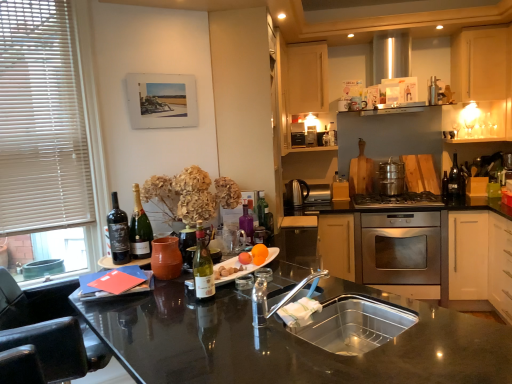
Question: Is light wood cabinet at upper center, the 2th cabinetry from the right, to the left of matte glass wine at left, which is counted as the second wine, starting from the right, from the viewer's perspective?

Choices:
 (A) no
 (B) yes

Answer: (A)

Question: Would you consider light wood cabinet at upper center, which is the first cabinetry from left to right, to be distant from matte glass wine at left, positioned as the first wine in left-to-right order?

Choices:
 (A) no
 (B) yes

Answer: (B)

Question: Considering the relative sizes of light wood cabinet at upper center, which is the first cabinetry from left to right, and matte glass wine at left, positioned as the first wine in left-to-right order, in the image provided, is light wood cabinet at upper center, which is the first cabinetry from left to right, thinner than matte glass wine at left, positioned as the first wine in left-to-right order,?

Choices:
 (A) yes
 (B) no

Answer: (B)

Question: Does light wood cabinet at upper center, which is the first cabinetry from left to right, come in front of matte glass wine at left, which is counted as the second wine, starting from the right?

Choices:
 (A) yes
 (B) no

Answer: (B)

Question: Is matte glass wine at left, which is counted as the second wine, starting from the right, a part of light wood cabinet at upper center, the 2th cabinetry from the right?

Choices:
 (A) no
 (B) yes

Answer: (A)

Question: Choose the correct answer: Is white blinds at left inside satin nickel kettle at center, marked as the 2th appliance in a back-to-front arrangement, or outside it?

Choices:
 (A) inside
 (B) outside

Answer: (B)

Question: From a real-world perspective, relative to satin nickel kettle at center, which is counted as the 2th appliance, starting from the right, is white blinds at left vertically above or below?

Choices:
 (A) above
 (B) below

Answer: (A)

Question: Is white blinds at left taller or shorter than satin nickel kettle at center, marked as the 2th appliance in a back-to-front arrangement?

Choices:
 (A) short
 (B) tall

Answer: (B)

Question: Is white blinds at left to the left or to the right of satin nickel kettle at center, the second appliance positioned from the front, in the image?

Choices:
 (A) left
 (B) right

Answer: (A)

Question: Does point (377, 340) appear closer or farther from the camera than point (240, 221)?

Choices:
 (A) closer
 (B) farther

Answer: (A)

Question: From the image's perspective, relative to matte glass wine at center, the second bottle in the left-to-right sequence, is stainless steel sink at center above or below?

Choices:
 (A) above
 (B) below

Answer: (B)

Question: Looking at their shapes, would you say stainless steel sink at center is wider or thinner than matte glass wine at center, arranged as the second bottle when viewed from the front?

Choices:
 (A) thin
 (B) wide

Answer: (B)

Question: Visually, is stainless steel sink at center positioned to the left or to the right of matte glass wine at center, arranged as the second bottle when viewed from the front?

Choices:
 (A) left
 (B) right

Answer: (B)

Question: From a real-world perspective, is light wood cabinet at upper center, which is the first cabinetry from left to right, positioned above or below green glass bottle at center, acting as the third bottle starting from the left?

Choices:
 (A) below
 (B) above

Answer: (B)

Question: Is light wood cabinet at upper center, the 2th cabinetry from the right, in front of or behind green glass bottle at center, positioned as the third bottle in front-to-back order, in the image?

Choices:
 (A) front
 (B) behind

Answer: (B)